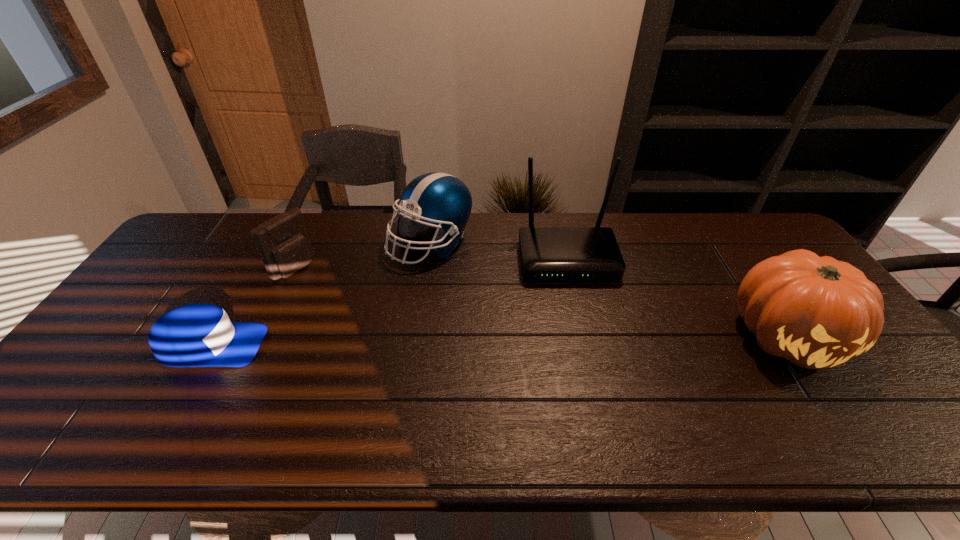
Identify the location of object that is at the near edge. (817, 312).

What are the coordinates of `object at the right edge` in the screenshot? It's located at (817, 312).

Identify the location of object present at the near right corner. The height and width of the screenshot is (540, 960). (817, 312).

Where is `vacant space at the far edge of the desktop`? vacant space at the far edge of the desktop is located at coordinates (260, 252).

The height and width of the screenshot is (540, 960). I want to click on free space at the near edge of the desktop, so coord(578,393).

You are a GUI agent. You are given a task and a screenshot of the screen. Output one action in this format:
    pyautogui.click(x=<x>, y=<y>)
    Task: Click on the vacant space at the left edge of the desktop
    
    Given the screenshot: What is the action you would take?
    pyautogui.click(x=108, y=370)

Where is `free space at the far left corner`? This screenshot has height=540, width=960. free space at the far left corner is located at coordinates (211, 213).

You are a GUI agent. You are given a task and a screenshot of the screen. Output one action in this format:
    pyautogui.click(x=<x>, y=<y>)
    Task: Click on the vacant area at the near left corner of the desktop
    The height and width of the screenshot is (540, 960).
    Given the screenshot: What is the action you would take?
    pyautogui.click(x=113, y=387)

Find the location of a particular element. Image resolution: width=960 pixels, height=540 pixels. free spot between the shortest object and the fourth object from left to right is located at coordinates (390, 302).

Find the location of a particular element. free space between the rightmost object and the football helmet is located at coordinates (609, 290).